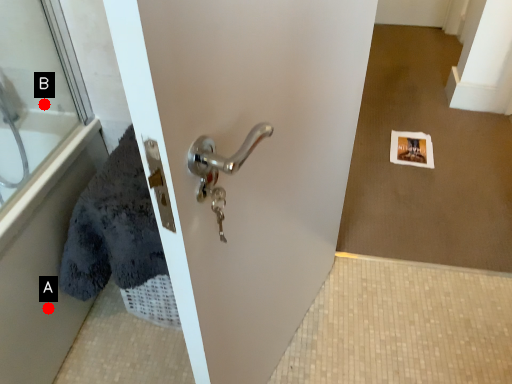
Question: Two points are circled on the image, labeled by A and B beside each circle. Which point is further to the camera?

Choices:
 (A) A is further
 (B) B is further

Answer: (B)